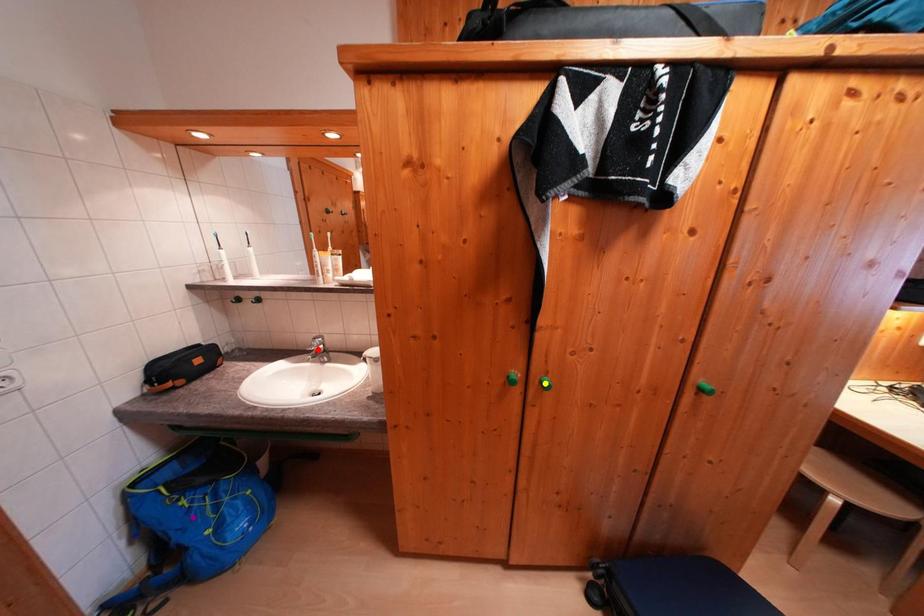
Order these from farthest to nearest:
red point
purple point
yellow point

red point
purple point
yellow point